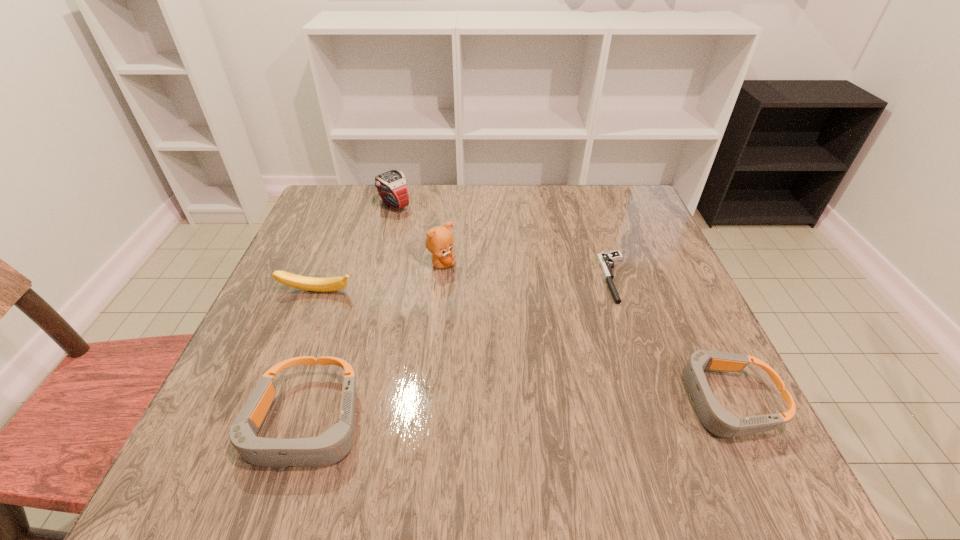
If we want them evenly spaced by inserting an extra goggles among them, please locate a free spot for this new goggles. Please provide its 2D coordinates. Your answer should be formatted as a tuple, i.e. [(x, y)], where the tuple contains the x and y coordinates of a point satisfying the conditions above.

[(521, 413)]